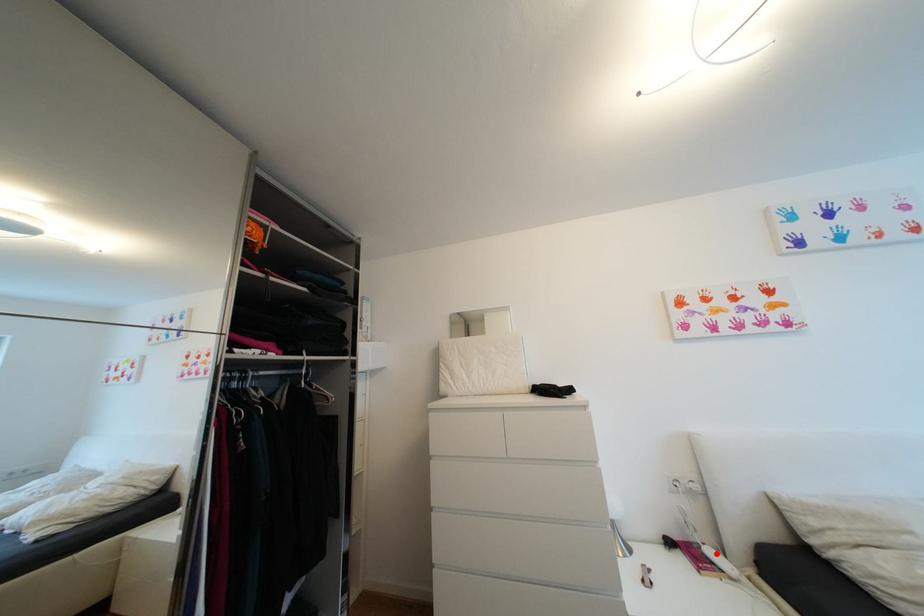
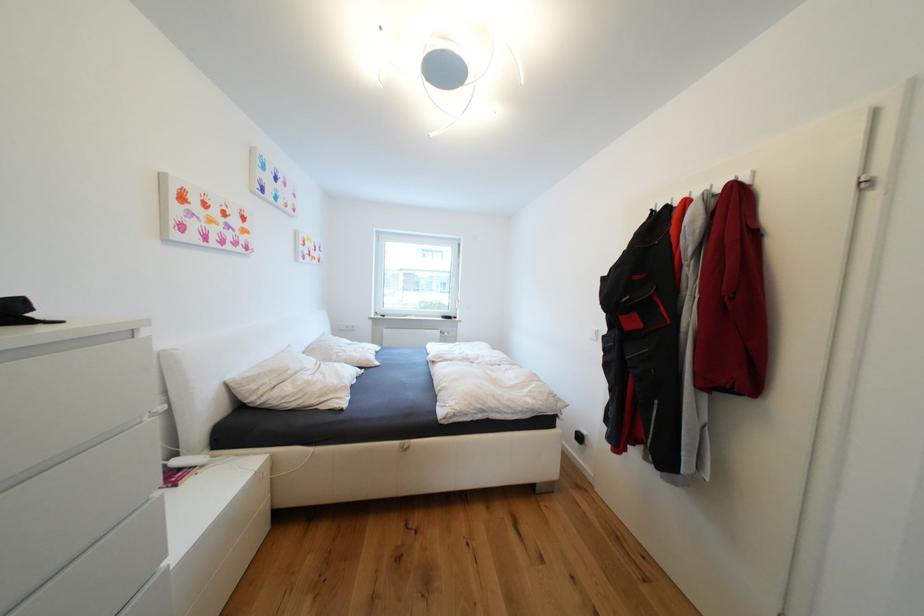
Question: I am providing you with two images of the same scene from different viewpoints. A red point is marked on the first image. Is the red point's position out of view in image 2?

Choices:
 (A) Yes
 (B) No

Answer: (B)